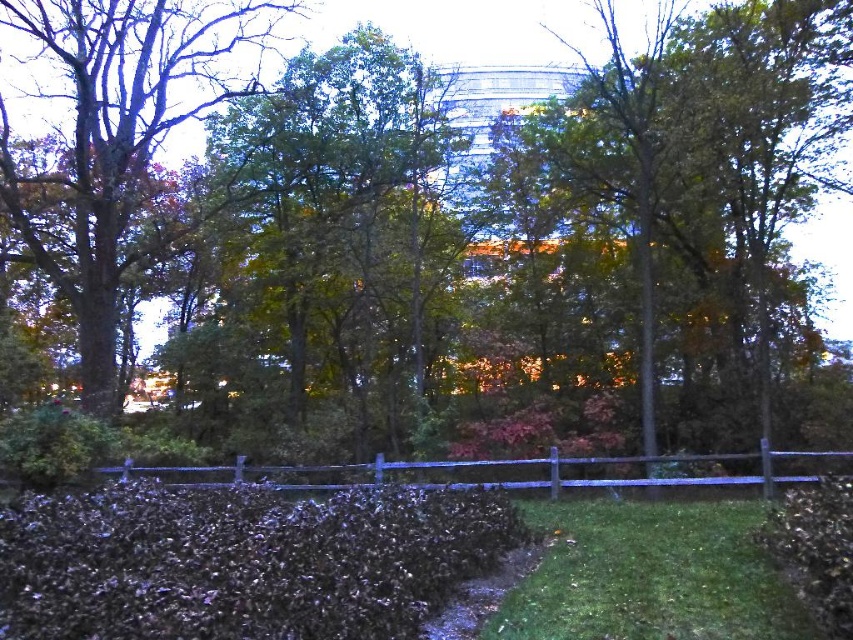
Question: From the image, what is the correct spatial relationship of green leafy tree at center in relation to dark green leafy hedge at lower left?

Choices:
 (A) right
 (B) left

Answer: (B)

Question: Does dark green leafy hedge at lower left appear over green grass at center?

Choices:
 (A) no
 (B) yes

Answer: (B)

Question: Which object is the closest to the green grass at center?

Choices:
 (A) green leafy tree at left
 (B) green leafy tree at center
 (C) dark green leafy hedge at lower left

Answer: (C)

Question: Is green leafy tree at center in front of green leafy tree at left?

Choices:
 (A) yes
 (B) no

Answer: (B)

Question: Which object appears closest to the camera in this image?

Choices:
 (A) green grass at center
 (B) green leafy tree at center
 (C) green leafy tree at left
 (D) dark green leafy hedge at lower left

Answer: (D)

Question: Among these objects, which one is farthest from the camera?

Choices:
 (A) green grass at center
 (B) green leafy tree at center
 (C) green leafy tree at left

Answer: (B)